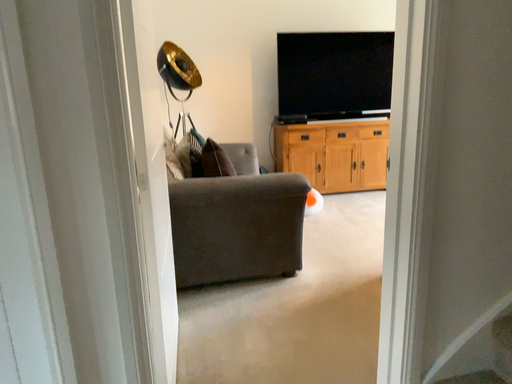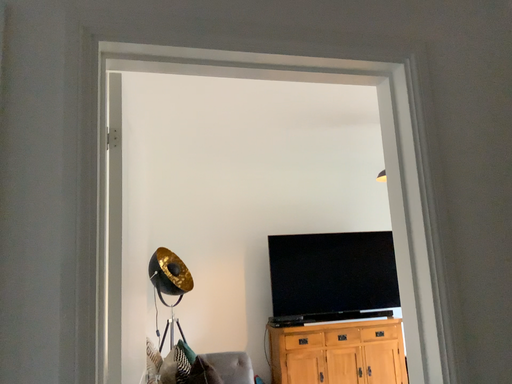
Question: Which way did the camera rotate in the video?

Choices:
 (A) rotated upward
 (B) rotated downward

Answer: (A)